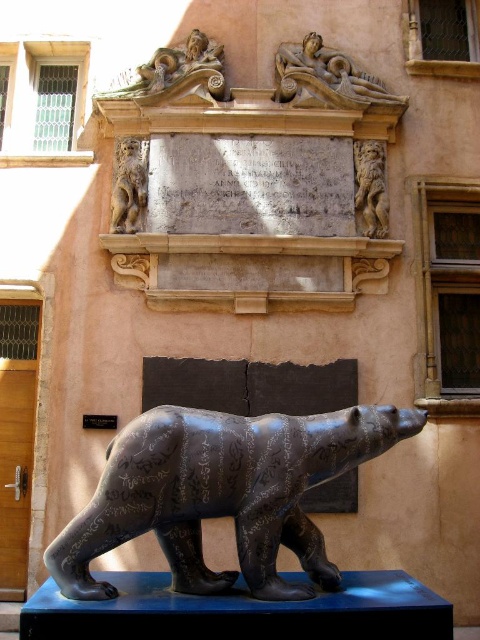
Is bronze bear at center bigger than black stone plaque at center?

Indeed, bronze bear at center has a larger size compared to black stone plaque at center.

Can you confirm if bronze bear at center is taller than black stone plaque at center?

Correct, bronze bear at center is much taller as black stone plaque at center.

Is point (261, 509) in front of point (99, 417)?

That is True.

The image size is (480, 640). What are the coordinates of `bronze bear at center` in the screenshot? It's located at (222, 493).

Who is more distant from viewer, (402,104) or (365,232)?

The point (402,104) is behind.

In the scene shown: Between stone reclining figure at upper center and bronze lion at upper right, which one is positioned lower?

bronze lion at upper right

Is point (331, 77) positioned after point (371, 202)?

Yes.

This screenshot has width=480, height=640. Identify the location of stone reclining figure at upper center. (325, 77).

In the scene shown: Is bronze bear at center in front of stone reclining figure at upper center?

Yes, bronze bear at center is in front of stone reclining figure at upper center.

Between point (158, 538) and point (339, 93), which one is positioned behind?

The point (339, 93) is behind.

Locate an element on the screen. This screenshot has width=480, height=640. bronze bear at center is located at coordinates (222, 493).

You are a GUI agent. You are given a task and a screenshot of the screen. Output one action in this format:
    pyautogui.click(x=<x>, y=<y>)
    Task: Click on the bronze bear at center
    The width and height of the screenshot is (480, 640).
    Given the screenshot: What is the action you would take?
    pyautogui.click(x=222, y=493)